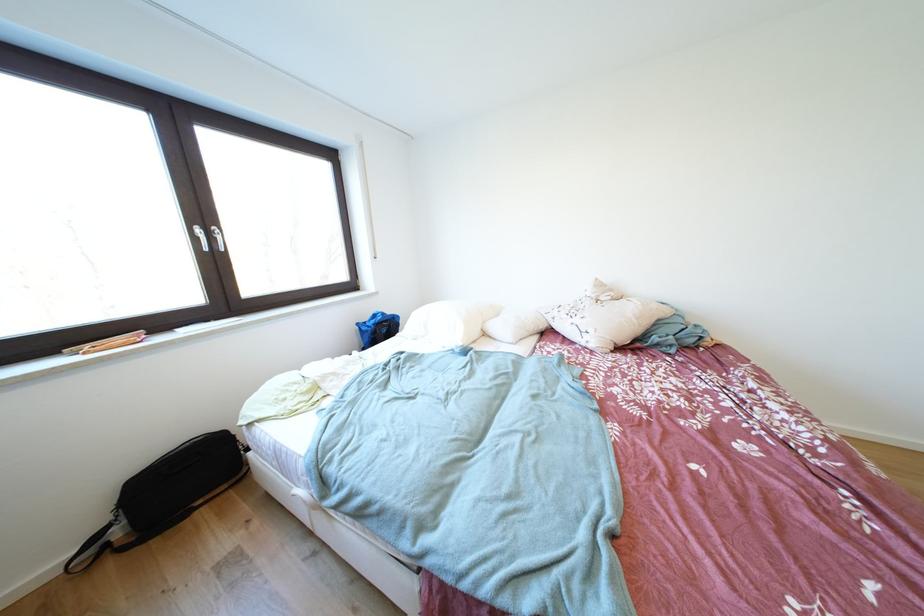
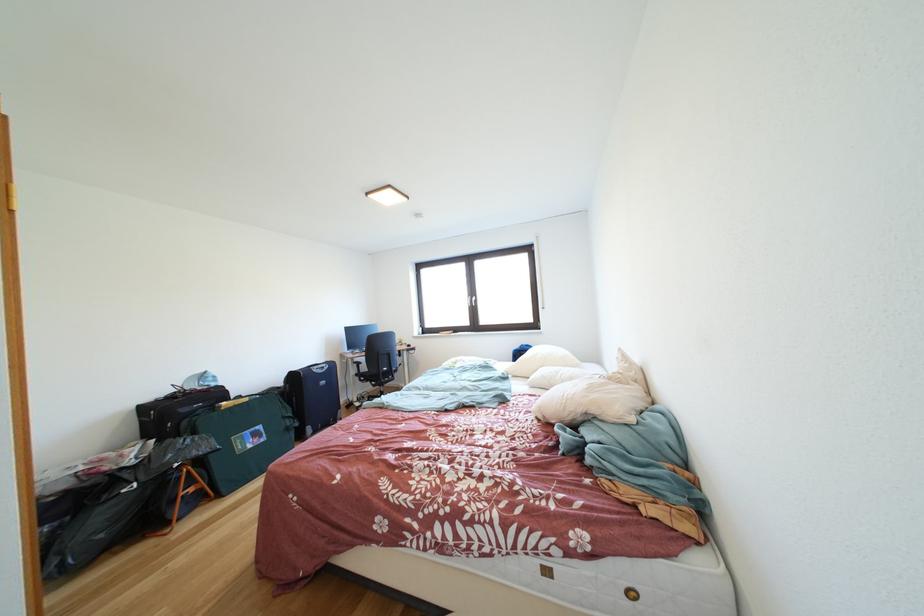
The point at (392, 318) is marked in the first image. Where is the corresponding point in the second image?

(535, 351)